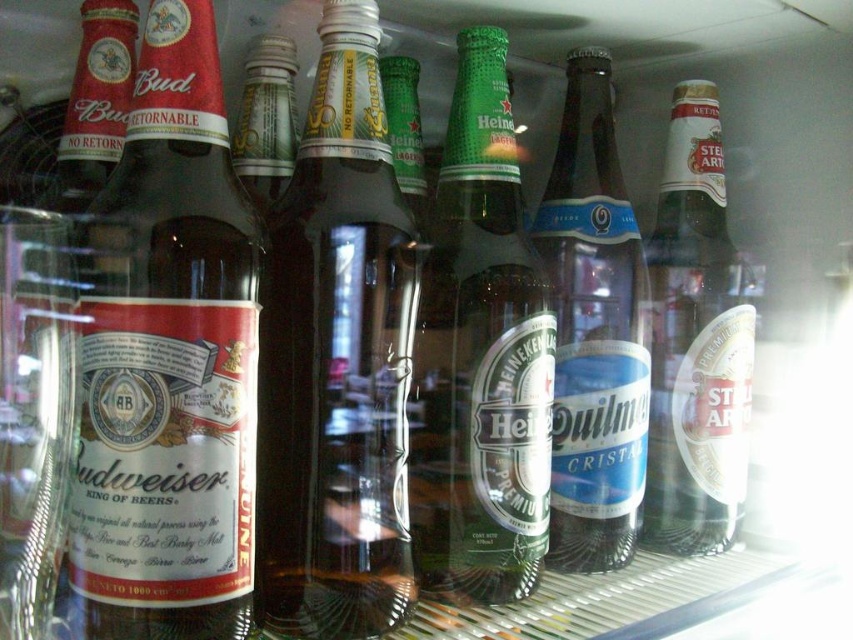
Can you confirm if matte glass bottle at left is positioned above blue glass bottle at center?

No, matte glass bottle at left is not above blue glass bottle at center.

Is matte glass bottle at left to the right of blue glass bottle at center from the viewer's perspective?

Incorrect, matte glass bottle at left is not on the right side of blue glass bottle at center.

Where is `matte glass bottle at left`? This screenshot has width=853, height=640. matte glass bottle at left is located at coordinates (167, 358).

Locate an element on the screen. green glass bottle at center is located at coordinates 480,356.

Who is lower down, green glass bottle at center or blue glass bottle at center?

green glass bottle at center is below.

Does point (486, 35) come behind point (564, 172)?

No.

Where is `green glass bottle at center`? The height and width of the screenshot is (640, 853). green glass bottle at center is located at coordinates (480, 356).

Does brown glass bottle at center appear on the right side of clear glass bottle at right?

In fact, brown glass bottle at center is to the left of clear glass bottle at right.

Can you confirm if brown glass bottle at center is thinner than clear glass bottle at right?

Indeed, brown glass bottle at center has a lesser width compared to clear glass bottle at right.

Locate an element on the screen. This screenshot has height=640, width=853. brown glass bottle at center is located at coordinates (337, 358).